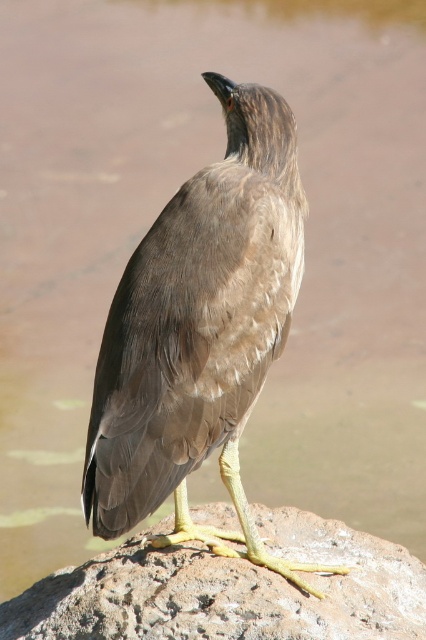
Question: Which point is farther to the camera?

Choices:
 (A) rocky surface at center
 (B) brown feathered bird at center

Answer: (B)

Question: In this image, where is brown feathered bird at center located relative to rocky surface at center?

Choices:
 (A) below
 (B) above

Answer: (B)

Question: Considering the relative positions of brown feathered bird at center and rocky surface at center in the image provided, where is brown feathered bird at center located with respect to rocky surface at center?

Choices:
 (A) above
 (B) below

Answer: (A)

Question: Which point appears farthest from the camera in this image?

Choices:
 (A) (325, 554)
 (B) (233, 291)

Answer: (A)

Question: Does brown feathered bird at center have a greater width compared to rocky surface at center?

Choices:
 (A) no
 (B) yes

Answer: (A)